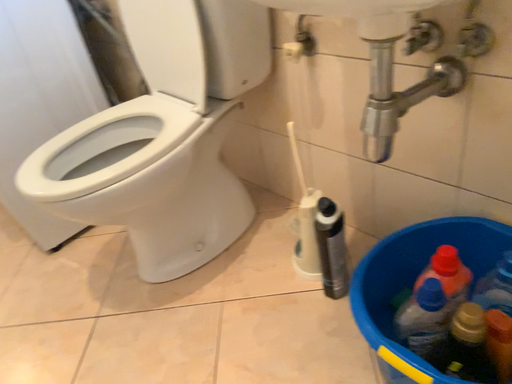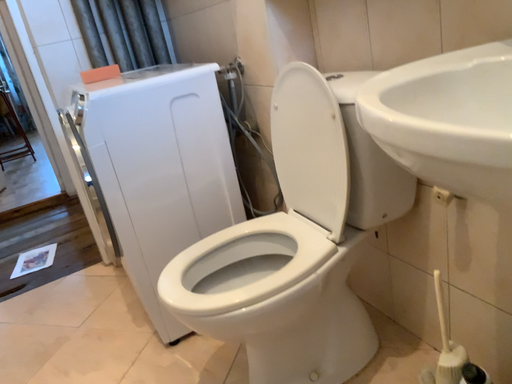
Question: Which way did the camera rotate in the video?

Choices:
 (A) rotated left
 (B) rotated right

Answer: (A)